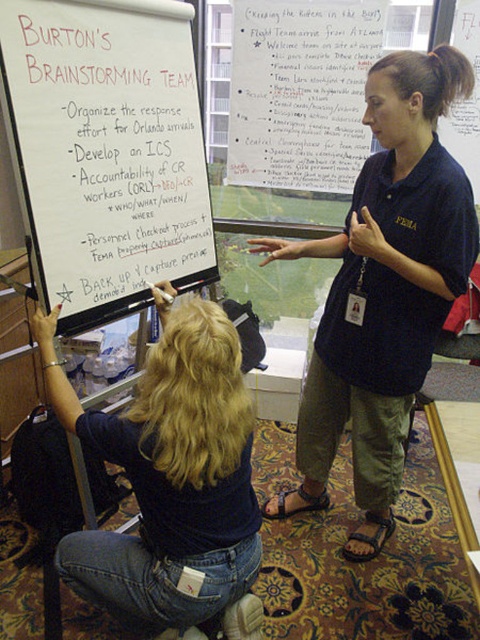
Question: Which of the following is the closest to the observer?

Choices:
 (A) denim jeans at lower left
 (B) whiteboard at upper left
 (C) dark blue shirt at center

Answer: (A)

Question: Does whiteboard at upper left come behind denim jeans at lower left?

Choices:
 (A) yes
 (B) no

Answer: (A)

Question: Among these objects, which one is farthest from the camera?

Choices:
 (A) whiteboard at upper left
 (B) dark blue shirt at center
 (C) denim jeans at lower left

Answer: (B)

Question: Where is whiteboard at upper left located in relation to dark blue shirt at center in the image?

Choices:
 (A) above
 (B) below

Answer: (A)

Question: Which point is closer to the camera?

Choices:
 (A) (83, 540)
 (B) (108, 124)
 (C) (420, 81)

Answer: (C)

Question: Can you confirm if dark blue shirt at center is positioned below denim jeans at lower left?

Choices:
 (A) no
 (B) yes

Answer: (A)